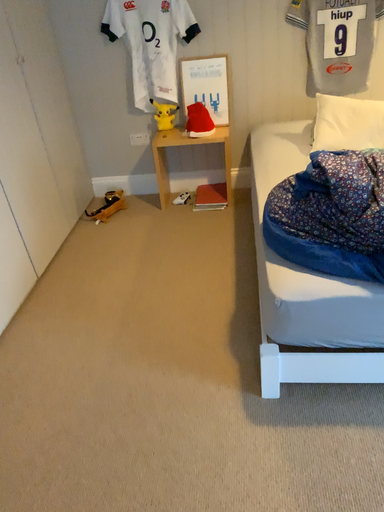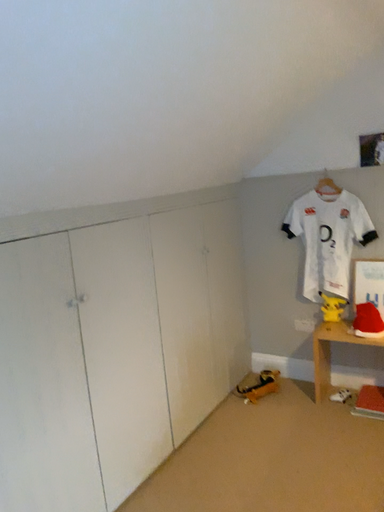
Question: How did the camera likely rotate when shooting the video?

Choices:
 (A) rotated left
 (B) rotated right

Answer: (A)